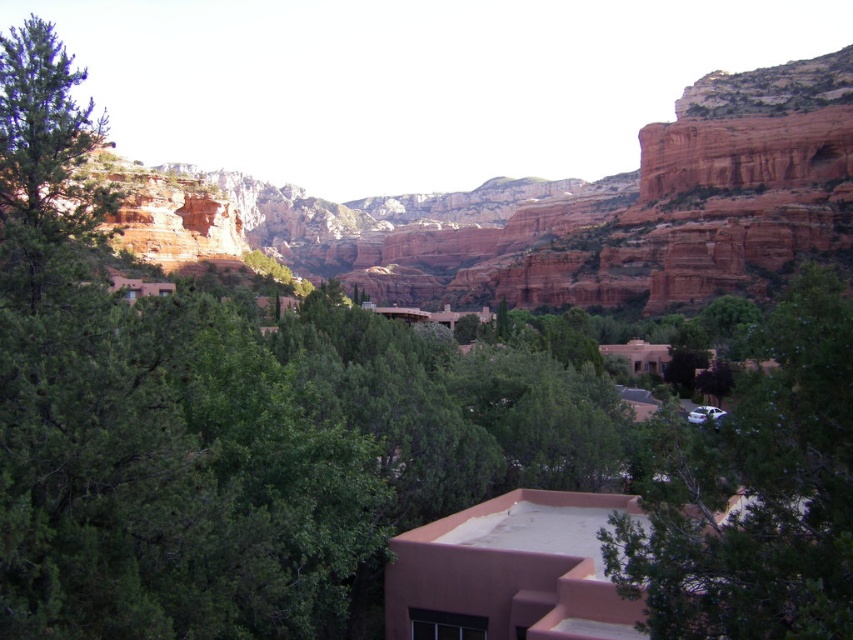
You are a hiker standing in the desert landscape. You see the rustic rock formation at center and the green leafy tree at center. Which object is higher in the scene?

The rustic rock formation at center is above the green leafy tree at center, so it is higher in the scene.

You are planning to set up a tent in the scenic landscape. The rustic rock formation at center and the green matte tree at left are both nearby. Based on their widths, which one would you choose to place your tent closer to for better space?

The rustic rock formation at center might be wider than green matte tree at left, so placing the tent closer to the rustic rock formation at center would likely provide more space.

Based on the coordinates provided in the scene description, where exactly is the rustic rock formation at center located?

The rustic rock formation at center is located at point (608, 209).